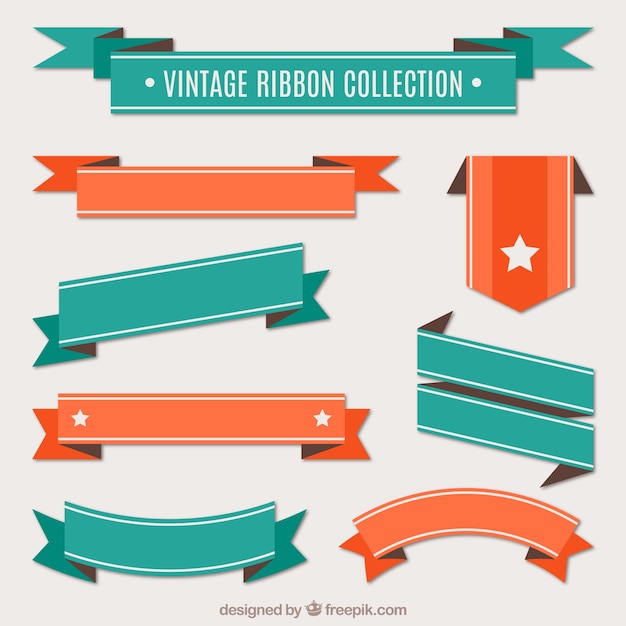
Find the location of a particular element. variety of ribbons in teal and orange color is located at coordinates (305, 96), (275, 181), (506, 216), (521, 365), (508, 431), (466, 501), (235, 536), (240, 422), (198, 309).